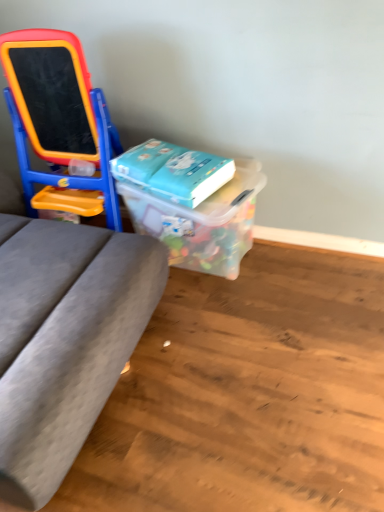
Where is `vacant area located to the right-hand side of translucent plastic container at center`? The height and width of the screenshot is (512, 384). vacant area located to the right-hand side of translucent plastic container at center is located at coordinates (309, 279).